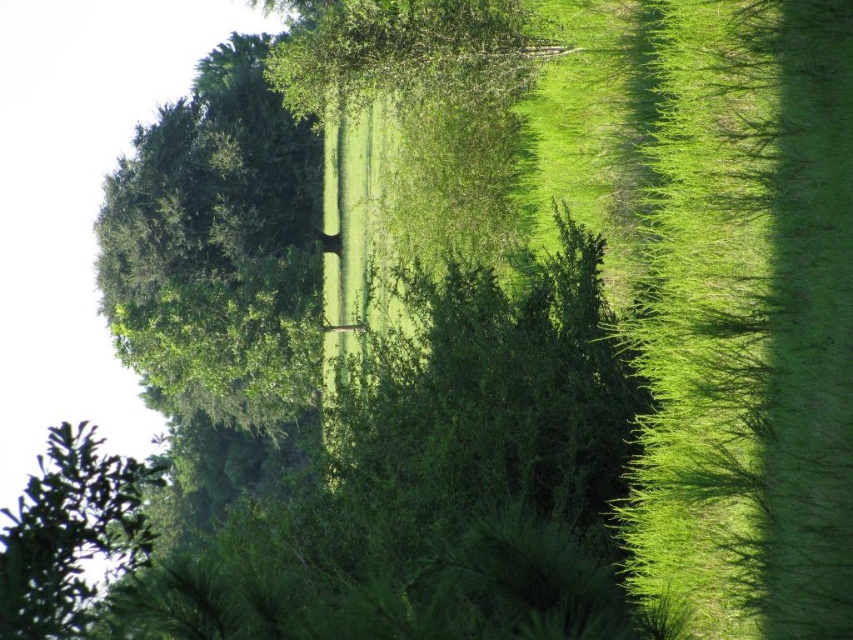
Question: Does green leafy hedge at center lie behind green leafy tree at upper left?

Choices:
 (A) yes
 (B) no

Answer: (A)

Question: Is green leafy hedge at center bigger than green leafy tree at upper left?

Choices:
 (A) yes
 (B) no

Answer: (B)

Question: Can you confirm if green leafy hedge at center is positioned below green leafy tree at upper left?

Choices:
 (A) no
 (B) yes

Answer: (A)

Question: Among these objects, which one is nearest to the camera?

Choices:
 (A) green leafy hedge at center
 (B) green leafy tree at upper left

Answer: (B)